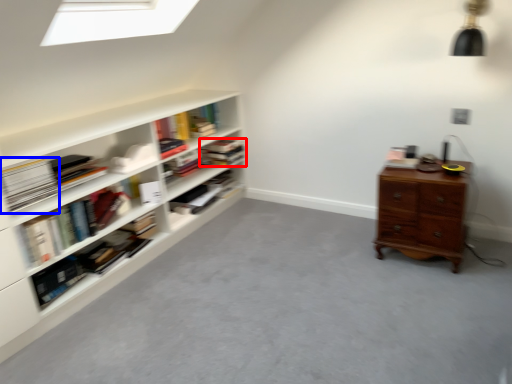
Question: Which object is further to the camera taking this photo, book (highlighted by a red box) or paperback book (highlighted by a blue box)?

Choices:
 (A) book
 (B) paperback book

Answer: (A)